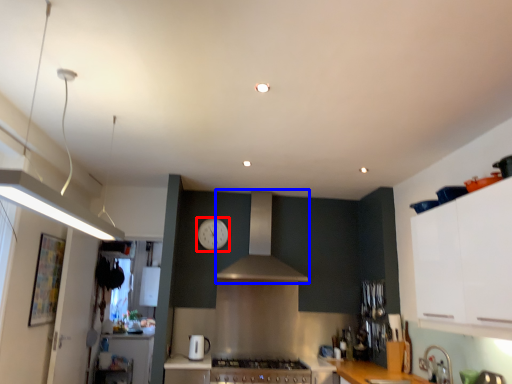
Question: Among these objects, which one is farthest to the camera, clock (highlighted by a red box) or hood (highlighted by a blue box)?

Choices:
 (A) clock
 (B) hood

Answer: (A)